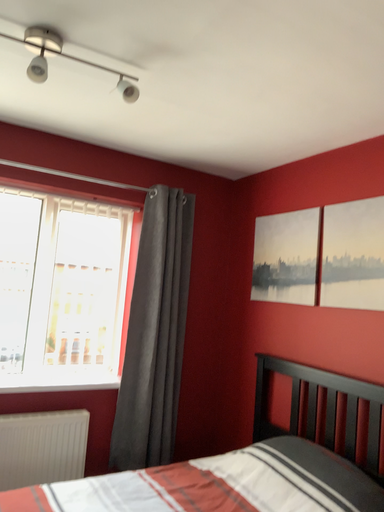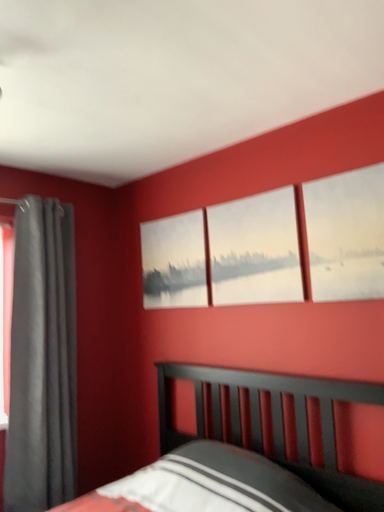
Question: Which way did the camera rotate in the video?

Choices:
 (A) rotated right
 (B) rotated left

Answer: (A)